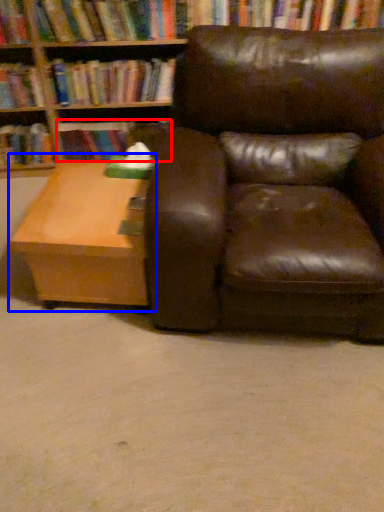
Question: Which point is further to the camera, book (highlighted by a red box) or table (highlighted by a blue box)?

Choices:
 (A) book
 (B) table

Answer: (A)